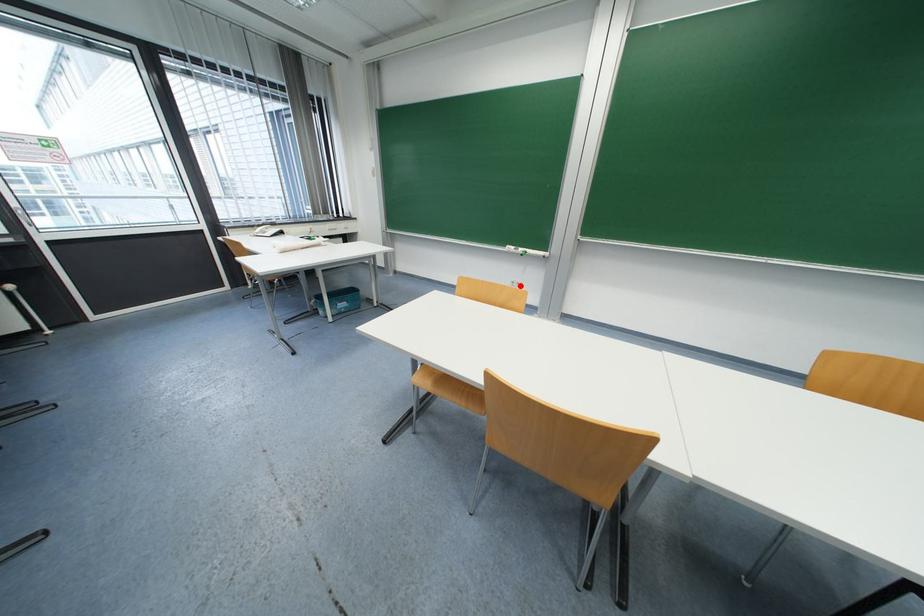
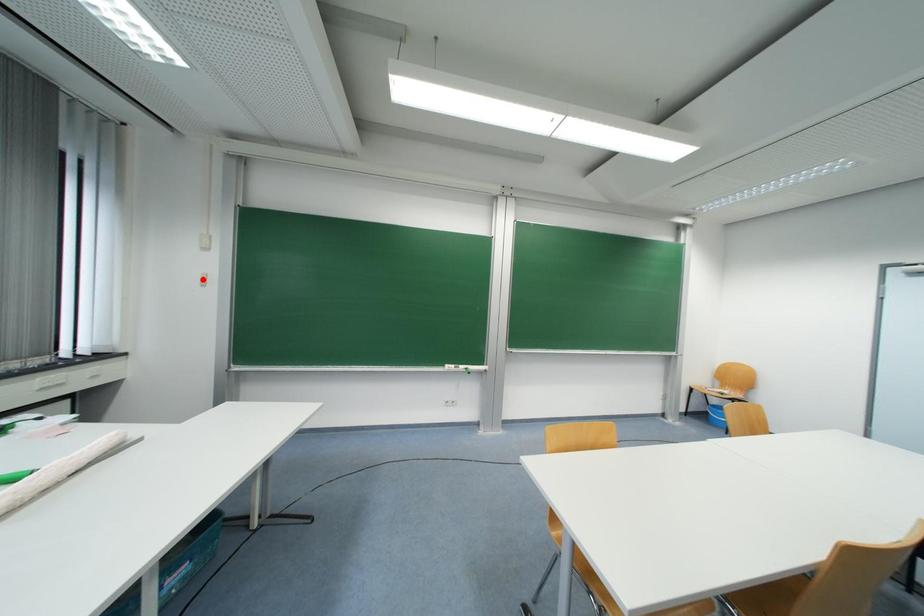
I am providing you with two images of the same scene from different viewpoints. A red point is marked on the first image and another point is marked on the second image. Do the highlighted points in image1 and image2 indicate the same real-world spot?

No